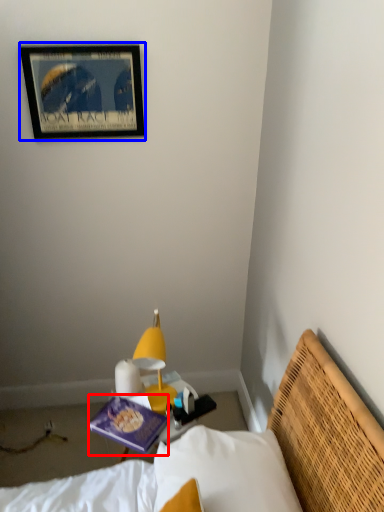
Question: Which object is further to the camera taking this photo, book (highlighted by a red box) or picture frame (highlighted by a blue box)?

Choices:
 (A) book
 (B) picture frame

Answer: (B)